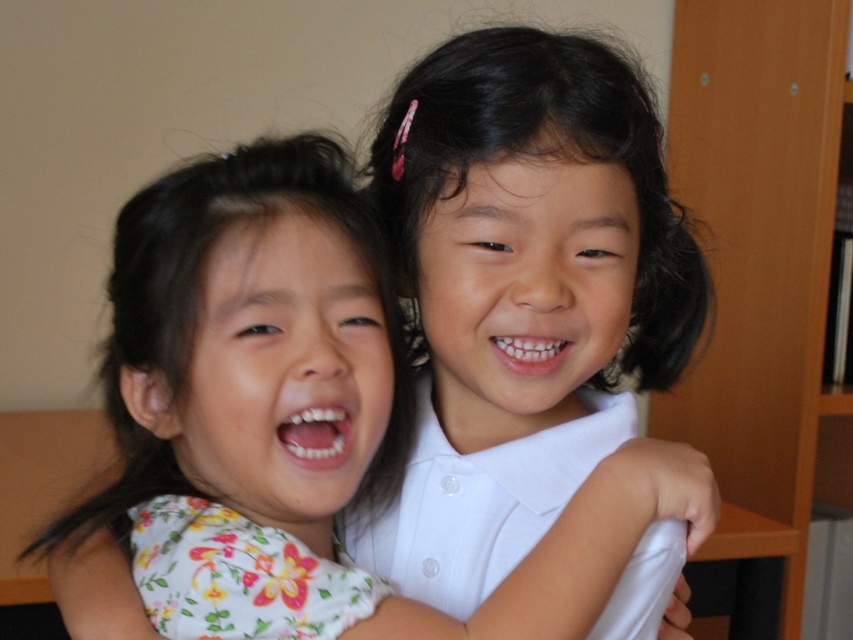
Is floral fabric shirt at center above wooden bookshelf at right?

No.

Who is positioned more to the left, floral fabric shirt at center or wooden bookshelf at right?

Positioned to the left is floral fabric shirt at center.

The width and height of the screenshot is (853, 640). What are the coordinates of `floral fabric shirt at center` in the screenshot? It's located at (251, 344).

Does white smooth shirt at upper right appear on the right side of floral fabric shirt at center?

Yes, white smooth shirt at upper right is to the right of floral fabric shirt at center.

Is white smooth shirt at upper right to the left of floral fabric shirt at center from the viewer's perspective?

Incorrect, white smooth shirt at upper right is not on the left side of floral fabric shirt at center.

Between point (517, 454) and point (624, 512), which one is positioned in front?

Positioned in front is point (624, 512).

The width and height of the screenshot is (853, 640). What are the coordinates of `white smooth shirt at upper right` in the screenshot? It's located at (521, 292).

Between point (517, 84) and point (740, 13), which one is positioned behind?

The point (740, 13) is more distant.

Which is more to the left, white smooth shirt at upper right or wooden bookshelf at right?

From the viewer's perspective, white smooth shirt at upper right appears more on the left side.

Where is `white smooth shirt at upper right`? white smooth shirt at upper right is located at coordinates (521, 292).

Locate an element on the screen. white smooth shirt at upper right is located at coordinates (521, 292).